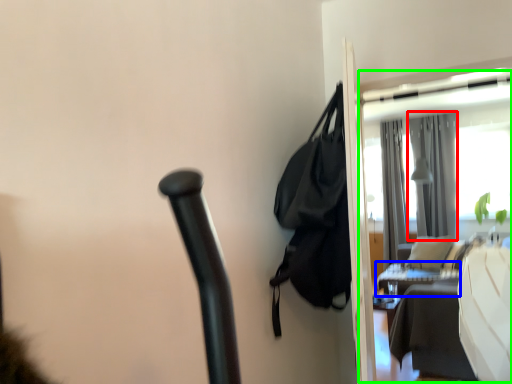
Question: Estimate the real-world distances between objects in this image. Which object is farther from curtain (highlighted by a red box), table (highlighted by a blue box) or screen door (highlighted by a green box)?

Choices:
 (A) table
 (B) screen door

Answer: (A)